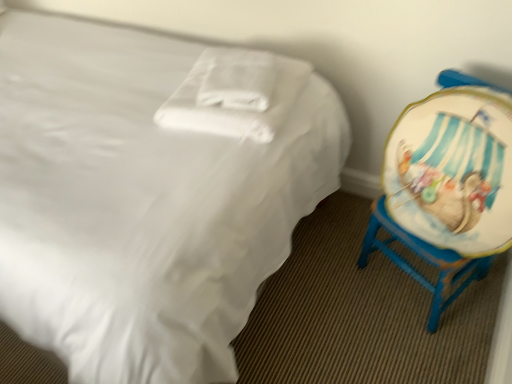
Question: Can you confirm if white soft pillow at center is taller than white satin bed at center?

Choices:
 (A) no
 (B) yes

Answer: (A)

Question: From the image's perspective, is white soft pillow at center above white satin bed at center?

Choices:
 (A) yes
 (B) no

Answer: (A)

Question: Can you confirm if white soft pillow at center is wider than white satin bed at center?

Choices:
 (A) yes
 (B) no

Answer: (B)

Question: Is the depth of white soft pillow at center less than that of white satin bed at center?

Choices:
 (A) no
 (B) yes

Answer: (A)

Question: From a real-world perspective, is white soft pillow at center under white satin bed at center?

Choices:
 (A) no
 (B) yes

Answer: (A)

Question: Is white soft pillow at center positioned beyond the bounds of white satin bed at center?

Choices:
 (A) no
 (B) yes

Answer: (A)

Question: Can you confirm if white satin bed at center is taller than wooden painted chair at right?

Choices:
 (A) yes
 (B) no

Answer: (A)

Question: From the image's perspective, is white satin bed at center above wooden painted chair at right?

Choices:
 (A) no
 (B) yes

Answer: (B)

Question: Does white satin bed at center appear on the left side of wooden painted chair at right?

Choices:
 (A) no
 (B) yes

Answer: (B)

Question: Can you confirm if white satin bed at center is bigger than wooden painted chair at right?

Choices:
 (A) yes
 (B) no

Answer: (A)

Question: Is white satin bed at center not inside wooden painted chair at right?

Choices:
 (A) yes
 (B) no

Answer: (A)

Question: From a real-world perspective, is white satin bed at center located higher than wooden painted chair at right?

Choices:
 (A) yes
 (B) no

Answer: (A)

Question: Could you tell me if wooden painted chair at right is facing white soft pillow at center?

Choices:
 (A) no
 (B) yes

Answer: (A)